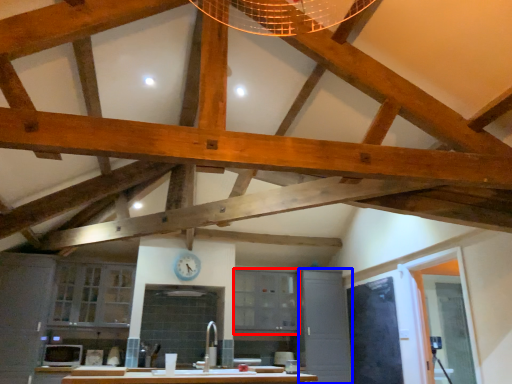
Question: Which object appears farthest to the camera in this image, cabinetry (highlighted by a red box) or cabinetry (highlighted by a blue box)?

Choices:
 (A) cabinetry
 (B) cabinetry

Answer: (A)